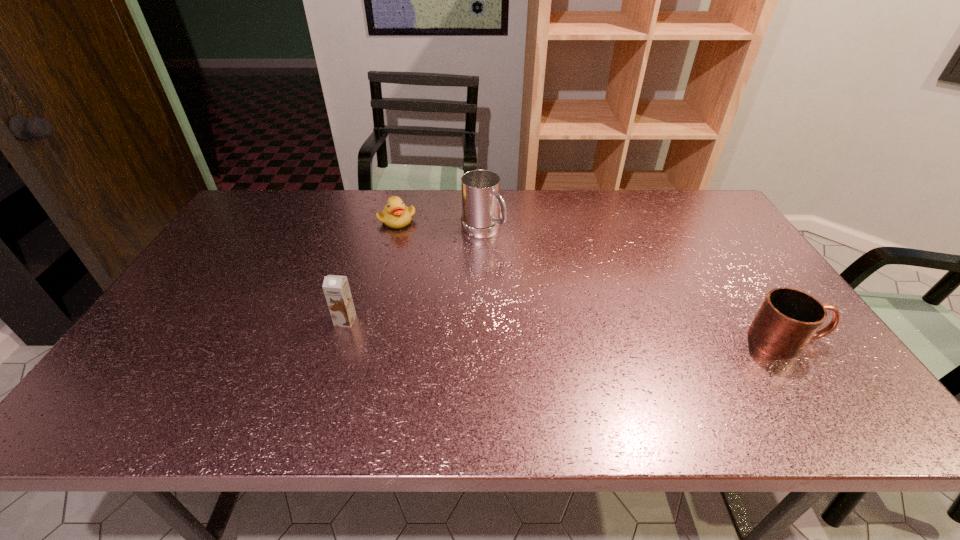
The image size is (960, 540). In order to click on free space that satisfies the following two spatial constraints: 1. on the back side of the left mug; 2. on the left side of the third shortest object in this screenshot , I will do `click(373, 230)`.

Identify the location of vacant space that satisfies the following two spatial constraints: 1. on the front side of the rightmost object; 2. on the side of the third object from left to right with the handle. Image resolution: width=960 pixels, height=540 pixels. (484, 340).